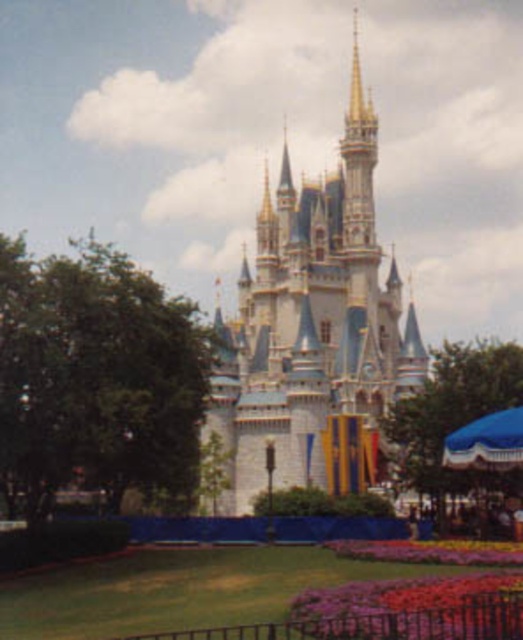
You are a gardener who wants to plant new flowers near the white glossy castle at center and the vivid multicolored petals at lower center. Based on their positions, which object is located higher in the image?

The white glossy castle at center is positioned over the vivid multicolored petals at lower center, so it is higher in the image.

You are a gardener standing at the edge of the lawn looking towards the castle. You see the vivid multicolored petals at lower center and the purple fabric flower at lower center. Which one is closer to you?

The vivid multicolored petals at lower center are closer to you because they are in front of the purple fabric flower at lower center.